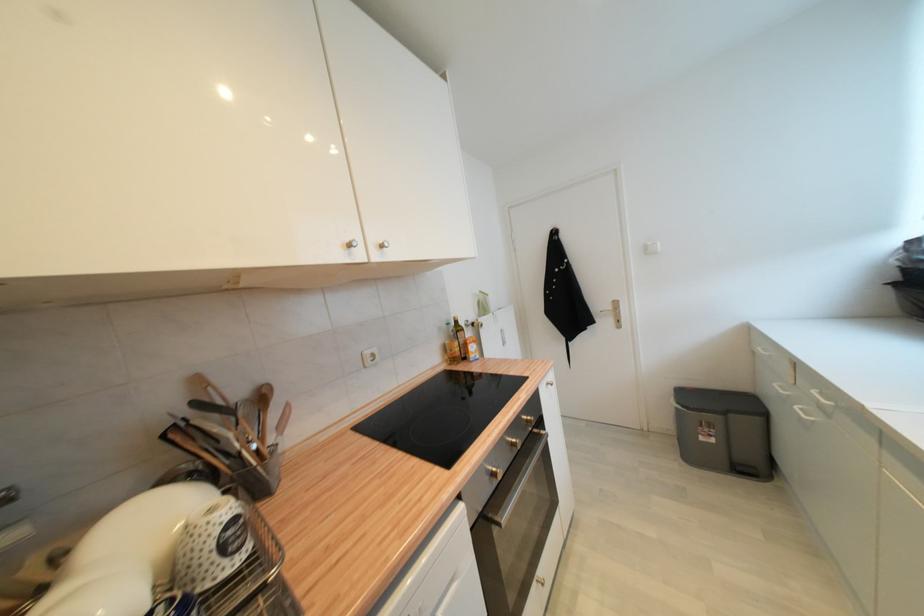
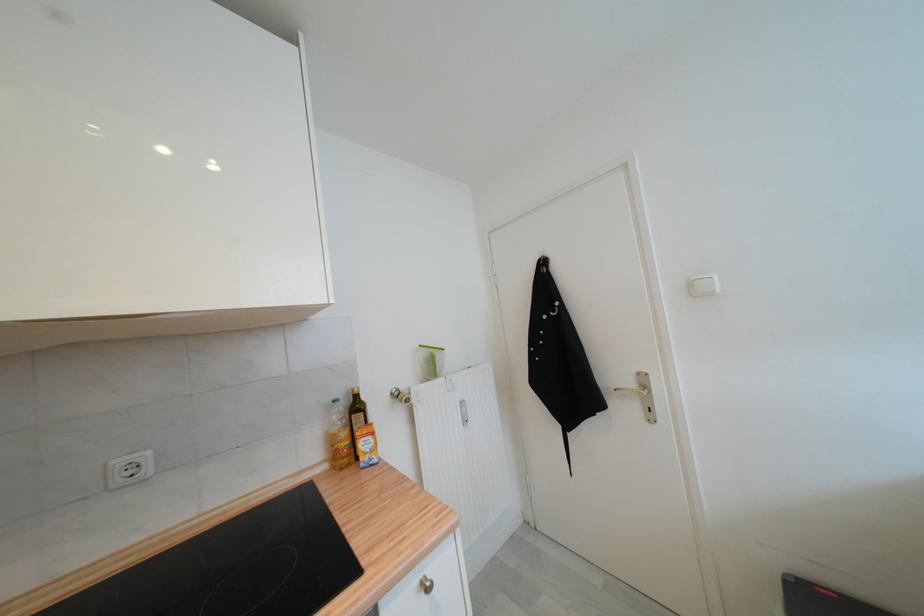
Where in the second image is the point corresponding to (453,326) from the first image?

(339, 403)